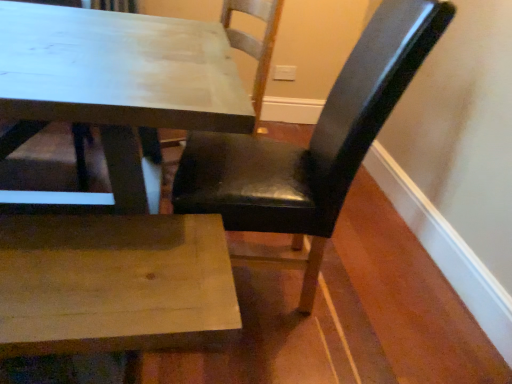
Question: Could you tell me if black leather chair at upper right, which is counted as the first chair, starting from the left, is turned towards black leather chair at center, the 1th chair viewed from the right?

Choices:
 (A) no
 (B) yes

Answer: (A)

Question: Is black leather chair at upper right, the second chair in the right-to-left sequence, turned away from black leather chair at center, the 1th chair viewed from the right?

Choices:
 (A) no
 (B) yes

Answer: (A)

Question: From a real-world perspective, is black leather chair at upper right, the second chair in the right-to-left sequence, located beneath black leather chair at center, the second chair in the left-to-right sequence?

Choices:
 (A) no
 (B) yes

Answer: (B)

Question: Can you confirm if black leather chair at upper right, the second chair in the right-to-left sequence, is wider than black leather chair at center, the second chair in the left-to-right sequence?

Choices:
 (A) yes
 (B) no

Answer: (A)

Question: From a real-world perspective, is black leather chair at upper right, the second chair in the right-to-left sequence, positioned over black leather chair at center, the second chair in the left-to-right sequence, based on gravity?

Choices:
 (A) no
 (B) yes

Answer: (A)

Question: Does black leather chair at upper right, which is counted as the first chair, starting from the left, have a larger size compared to black leather chair at center, the second chair in the left-to-right sequence?

Choices:
 (A) yes
 (B) no

Answer: (A)

Question: Is black leather chair at center, the 1th chair viewed from the right, far from black leather chair at upper right, which is counted as the first chair, starting from the left?

Choices:
 (A) no
 (B) yes

Answer: (A)

Question: Considering the relative sizes of black leather chair at center, the second chair in the left-to-right sequence, and black leather chair at upper right, which is counted as the first chair, starting from the left, in the image provided, is black leather chair at center, the second chair in the left-to-right sequence, shorter than black leather chair at upper right, which is counted as the first chair, starting from the left,?

Choices:
 (A) yes
 (B) no

Answer: (B)

Question: Is black leather chair at center, the second chair in the left-to-right sequence, outside black leather chair at upper right, the second chair in the right-to-left sequence?

Choices:
 (A) no
 (B) yes

Answer: (B)

Question: From a real-world perspective, is black leather chair at center, the second chair in the left-to-right sequence, located higher than black leather chair at upper right, which is counted as the first chair, starting from the left?

Choices:
 (A) yes
 (B) no

Answer: (A)

Question: Is black leather chair at center, the 1th chair viewed from the right, next to black leather chair at upper right, the second chair in the right-to-left sequence?

Choices:
 (A) no
 (B) yes

Answer: (A)

Question: From the image's perspective, does black leather chair at center, the second chair in the left-to-right sequence, appear higher than black leather chair at upper right, which is counted as the first chair, starting from the left?

Choices:
 (A) yes
 (B) no

Answer: (B)

Question: Is black leather chair at center, the second chair in the left-to-right sequence, spatially inside black leather chair at upper right, which is counted as the first chair, starting from the left, or outside of it?

Choices:
 (A) outside
 (B) inside

Answer: (A)